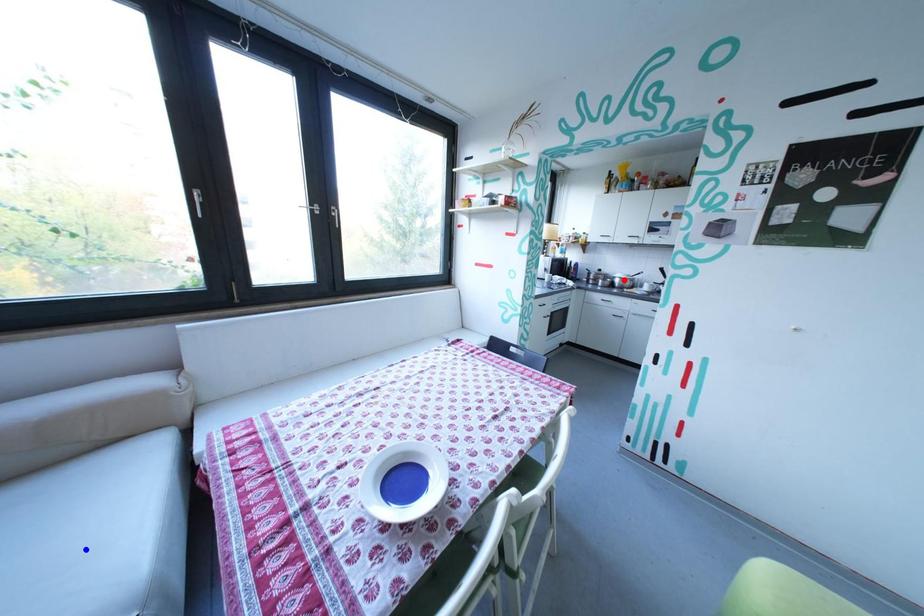
Question: Which of the two points in the image is closer to the camera?

Choices:
 (A) Blue point is closer.
 (B) Red point is closer.

Answer: (A)